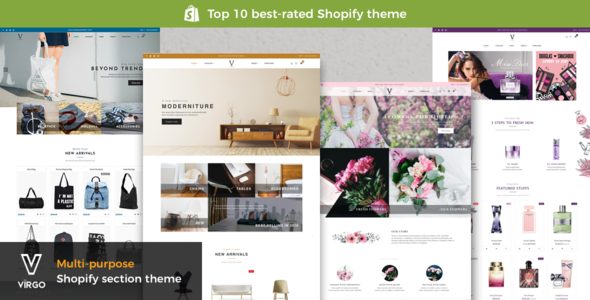
At what (x,y) coordinates should I click in order to perform the action: click on chairs. Please return your answer as a coordinate pair (x, y). The image size is (590, 300). Looking at the image, I should click on (277, 286), (300, 123).